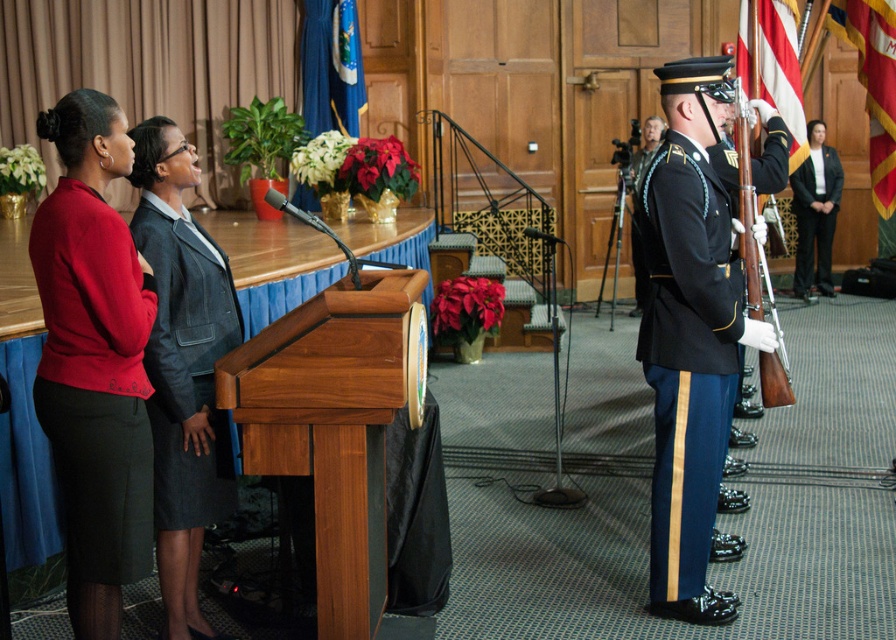
Based on the photo, can you confirm if matte red sweater at left is taller than black wool suit at right?

Incorrect, matte red sweater at left's height is not larger of black wool suit at right's.

In order to click on matte red sweater at left in this screenshot , I will do `click(95, 381)`.

This screenshot has width=896, height=640. In order to click on matte red sweater at left in this screenshot , I will do `click(95, 381)`.

Is matte red sweater at left to the right of shiny blue fabric uniform at center from the viewer's perspective?

No, matte red sweater at left is not to the right of shiny blue fabric uniform at center.

Which is behind, point (69, 513) or point (633, 236)?

Positioned behind is point (633, 236).

Locate an element on the screen. matte red sweater at left is located at coordinates (95, 381).

Between shiny black uniform at right and gray wool suit at center, which one is positioned higher?

gray wool suit at center is above.

This screenshot has height=640, width=896. Describe the element at coordinates (687, 358) in the screenshot. I see `shiny black uniform at right` at that location.

At what (x,y) coordinates should I click in order to perform the action: click on shiny black uniform at right. Please return your answer as a coordinate pair (x, y). Image resolution: width=896 pixels, height=640 pixels. Looking at the image, I should click on (687, 358).